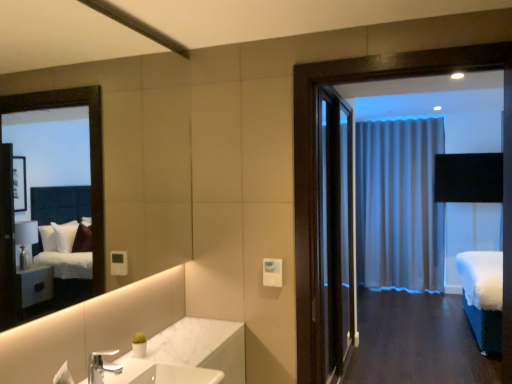
Question: Does dark wood door at center have a lesser width compared to silver metallic faucet at lower left?

Choices:
 (A) yes
 (B) no

Answer: (B)

Question: From the image's perspective, is dark wood door at center on top of silver metallic faucet at lower left?

Choices:
 (A) no
 (B) yes

Answer: (B)

Question: Considering the relative positions of dark wood door at center and silver metallic faucet at lower left in the image provided, is dark wood door at center in front of silver metallic faucet at lower left?

Choices:
 (A) no
 (B) yes

Answer: (A)

Question: Is there a large distance between dark wood door at center and silver metallic faucet at lower left?

Choices:
 (A) yes
 (B) no

Answer: (A)

Question: Is dark wood door at center behind silver metallic faucet at lower left?

Choices:
 (A) yes
 (B) no

Answer: (A)

Question: Is dark wood door at center to the right of silver metallic faucet at lower left from the viewer's perspective?

Choices:
 (A) no
 (B) yes

Answer: (B)

Question: From a real-world perspective, is white marble sink at lower center under silky gray curtain at center?

Choices:
 (A) no
 (B) yes

Answer: (B)

Question: Is white marble sink at lower center shorter than silky gray curtain at center?

Choices:
 (A) no
 (B) yes

Answer: (B)

Question: Is white marble sink at lower center further to camera compared to silky gray curtain at center?

Choices:
 (A) no
 (B) yes

Answer: (A)

Question: Is white marble sink at lower center thinner than silky gray curtain at center?

Choices:
 (A) yes
 (B) no

Answer: (B)

Question: Considering the relative positions of white marble sink at lower center and silky gray curtain at center in the image provided, is white marble sink at lower center to the left of silky gray curtain at center from the viewer's perspective?

Choices:
 (A) yes
 (B) no

Answer: (A)

Question: Considering the relative sizes of white marble sink at lower center and silky gray curtain at center in the image provided, is white marble sink at lower center wider than silky gray curtain at center?

Choices:
 (A) no
 (B) yes

Answer: (B)

Question: Is silver metallic faucet at lower left looking in the opposite direction of silky gray curtain at center?

Choices:
 (A) yes
 (B) no

Answer: (B)